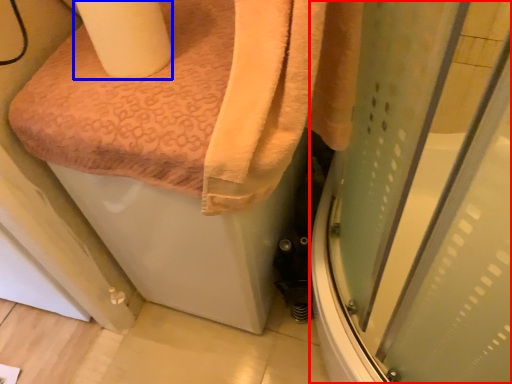
Question: Which of the following is the closest to the observer, screen door (highlighted by a red box) or toilet paper (highlighted by a blue box)?

Choices:
 (A) screen door
 (B) toilet paper

Answer: (A)